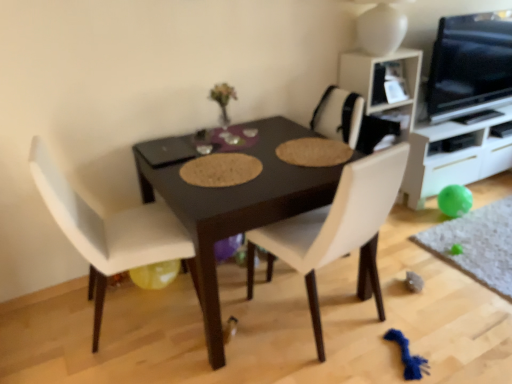
This screenshot has height=384, width=512. In order to click on vacant area situated to the left side of white leather chair at left, the 1th chair in the left-to-right sequence in this screenshot , I will do `click(47, 331)`.